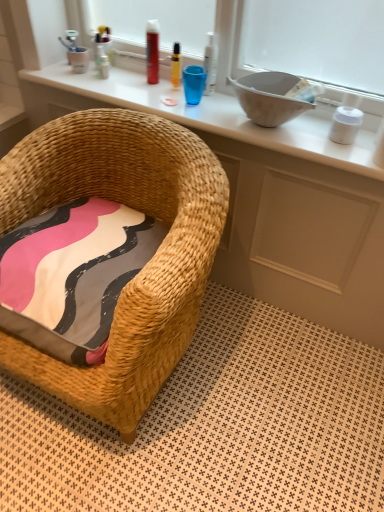
This screenshot has width=384, height=512. Find the location of `free space in front of white matte container at upper right, marked as the 1th toiletry in a right-to-left arrangement`. free space in front of white matte container at upper right, marked as the 1th toiletry in a right-to-left arrangement is located at coordinates (346, 152).